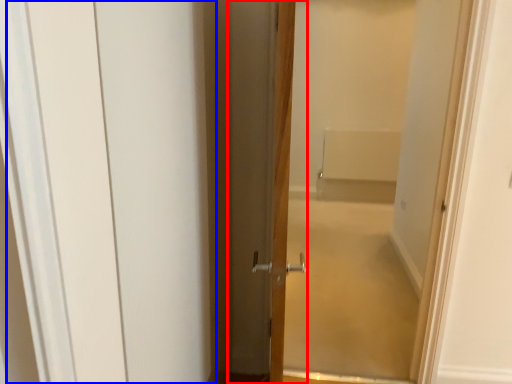
Question: Among these objects, which one is nearest to the camera, door (highlighted by a red box) or barn door (highlighted by a blue box)?

Choices:
 (A) door
 (B) barn door

Answer: (B)